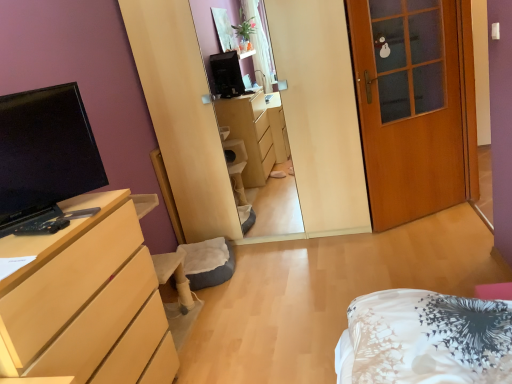
You are a GUI agent. You are given a task and a screenshot of the screen. Output one action in this format:
    pyautogui.click(x=<x>, y=<y>)
    Task: Click on the wooden door at right
    The height and width of the screenshot is (384, 512).
    Given the screenshot: What is the action you would take?
    pyautogui.click(x=415, y=105)

This screenshot has width=512, height=384. What do you see at coordinates (415, 105) in the screenshot?
I see `wooden door at right` at bounding box center [415, 105].

What do you see at coordinates (86, 300) in the screenshot? Image resolution: width=512 pixels, height=384 pixels. I see `light wood/finish dresser at left` at bounding box center [86, 300].

Where is `matte black tv at left`? matte black tv at left is located at coordinates (44, 154).

Looking at this image, from the image's perspective, is wooden door at right above or below matte black tv at left?

Based on their image positions, wooden door at right is located above matte black tv at left.

Considering the relative positions of wooden door at right and matte black tv at left in the image provided, is wooden door at right to the right of matte black tv at left from the viewer's perspective?

Correct, you'll find wooden door at right to the right of matte black tv at left.

Can you confirm if wooden door at right is shorter than matte black tv at left?

In fact, wooden door at right may be taller than matte black tv at left.

Does wooden door at right turn towards matte black tv at left?

No, wooden door at right is not oriented towards matte black tv at left.

Is matte black tv at left in contact with wooden door at right?

No, matte black tv at left is not next to wooden door at right.

Can you confirm if matte black tv at left is smaller than wooden door at right?

Yes, matte black tv at left is smaller than wooden door at right.

Based on the photo, which object is positioned more to the right, matte black tv at left or wooden door at right?

From the viewer's perspective, wooden door at right appears more on the right side.

From a real-world perspective, who is located higher, wooden door at right or light wood/finish dresser at left?

In real-world perspective, wooden door at right is above.

Which object is closer to the camera, wooden door at right or light wood/finish dresser at left?

light wood/finish dresser at left is more forward.

Who is bigger, wooden door at right or light wood/finish dresser at left?

With larger size is light wood/finish dresser at left.

Considering the sizes of objects light wood/finish dresser at left and matte black tv at left in the image provided, who is shorter, light wood/finish dresser at left or matte black tv at left?

With less height is matte black tv at left.

Is light wood/finish dresser at left not near matte black tv at left?

They are positioned close to each other.

Which is more to the right, light wood/finish dresser at left or matte black tv at left?

light wood/finish dresser at left.

Is light wood/finish dresser at left smaller than matte black tv at left?

No, light wood/finish dresser at left is not smaller than matte black tv at left.

Looking at this image, considering the relative positions of matte black tv at left and light wood/finish dresser at left in the image provided, is matte black tv at left to the right of light wood/finish dresser at left from the viewer's perspective?

In fact, matte black tv at left is to the left of light wood/finish dresser at left.

Find the location of a particular element. The width and height of the screenshot is (512, 384). cabinetry below the matte black tv at left (from a real-world perspective) is located at coordinates (86, 300).

In terms of width, does matte black tv at left look wider or thinner when compared to light wood/finish dresser at left?

Considering their sizes, matte black tv at left looks slimmer than light wood/finish dresser at left.

Is matte black tv at left facing towards light wood/finish dresser at left?

No, matte black tv at left is not aimed at light wood/finish dresser at left.

Is light wood/finish dresser at left positioned far away from wooden door at right?

Yes.

Can you confirm if light wood/finish dresser at left is smaller than wooden door at right?

Actually, light wood/finish dresser at left might be larger than wooden door at right.

From the image's perspective, relative to wooden door at right, is light wood/finish dresser at left above or below?

light wood/finish dresser at left is situated lower than wooden door at right in the image.

Would you say light wood/finish dresser at left is outside wooden door at right?

That's correct, light wood/finish dresser at left is outside of wooden door at right.

This screenshot has height=384, width=512. I want to click on television above the wooden door at right (from a real-world perspective), so coord(44,154).

Locate an element on the screen. This screenshot has width=512, height=384. television on the left of the wooden door at right is located at coordinates (44, 154).

Looking at the image, which one is located closer to wooden door at right, matte black tv at left or light wood/finish dresser at left?

light wood/finish dresser at left lies closer to wooden door at right than the other object.

From the image, which object appears to be nearer to wooden door at right, light wood/finish dresser at left or matte black tv at left?

Based on the image, light wood/finish dresser at left appears to be nearer to wooden door at right.

Looking at the image, which one is located further to light wood/finish dresser at left, matte black tv at left or wooden door at right?

wooden door at right.

Considering their positions, is light wood/finish dresser at left positioned further to matte black tv at left than wooden door at right?

Among the two, wooden door at right is located further to matte black tv at left.

Looking at the image, which one is located closer to matte black tv at left, wooden door at right or light wood/finish dresser at left?

The object closer to matte black tv at left is light wood/finish dresser at left.

When comparing their distances from light wood/finish dresser at left, does wooden door at right or matte black tv at left seem closer?

matte black tv at left.

Where is `cabinetry between matte black tv at left and wooden door at right in the horizontal direction`? The height and width of the screenshot is (384, 512). cabinetry between matte black tv at left and wooden door at right in the horizontal direction is located at coordinates (86, 300).